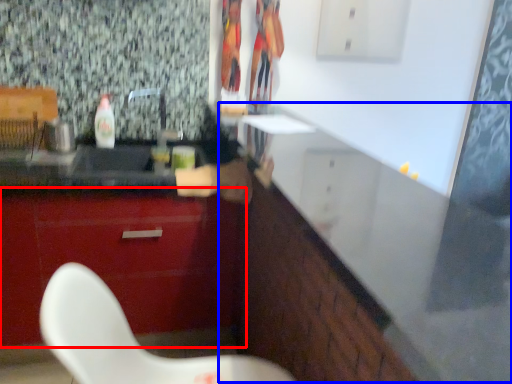
Question: Among these objects, which one is nearest to the camera, cabinetry (highlighted by a red box) or counter (highlighted by a blue box)?

Choices:
 (A) cabinetry
 (B) counter

Answer: (B)